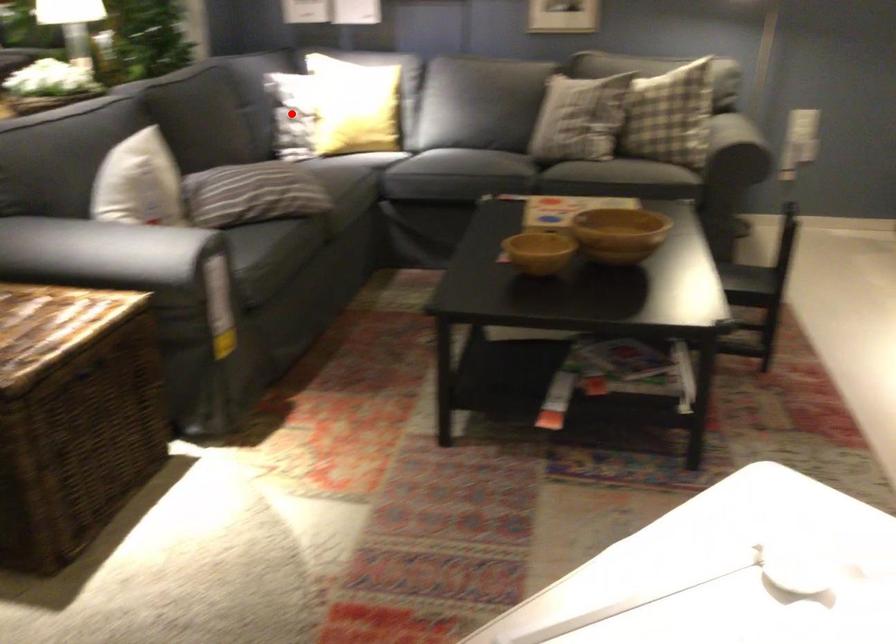
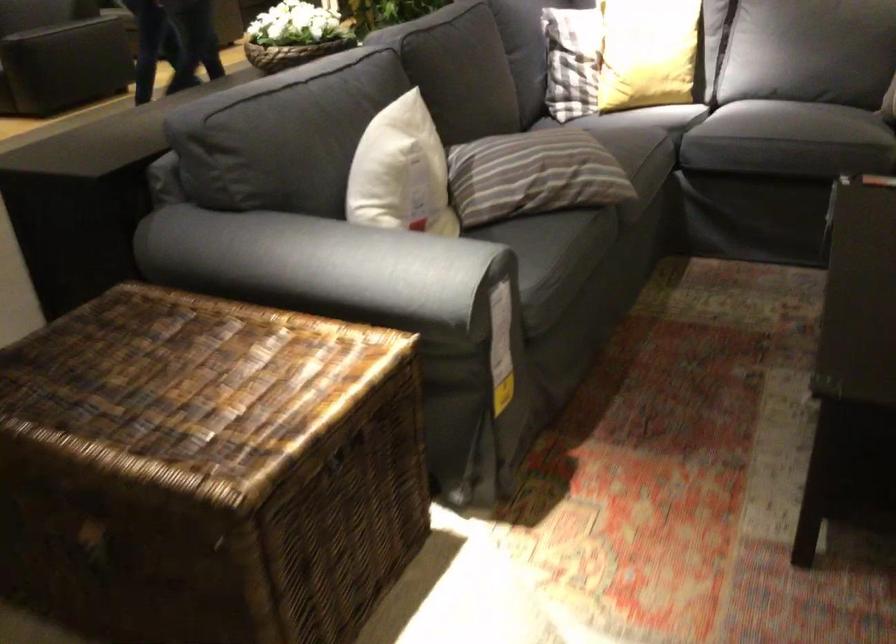
Find the pixel in the second image that matches the highlighted location in the first image.

(572, 61)